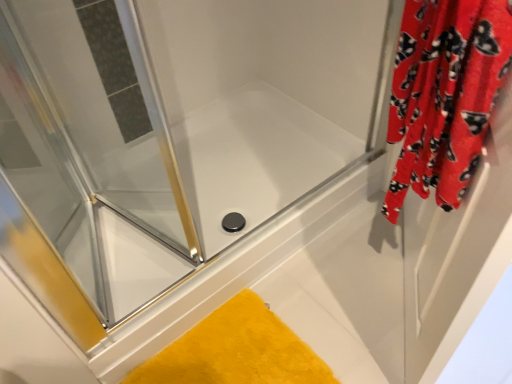
Describe the element at coordinates (91, 150) in the screenshot. The width and height of the screenshot is (512, 384). I see `clear glass shower door at upper left, the 1th screen door in the left-to-right sequence` at that location.

At what (x,y) coordinates should I click in order to perform the action: click on yellow plush bath mat at lower center. Please return your answer as a coordinate pair (x, y). Image resolution: width=512 pixels, height=384 pixels. Looking at the image, I should click on (236, 351).

Measure the distance between point (406, 42) and camera.

They are 30.79 inches apart.

This screenshot has width=512, height=384. What are the coordinates of `clear glass shower door at upper left, arranged as the second screen door when viewed from the right` in the screenshot? It's located at (91, 150).

Is clear glass shower door at upper left, the 1th screen door in the left-to-right sequence, not near red velvet curtain at right?

They are positioned close to each other.

Is clear glass shower door at upper left, the 1th screen door in the left-to-right sequence, in front of red velvet curtain at right?

No, clear glass shower door at upper left, the 1th screen door in the left-to-right sequence, is further to the viewer.

From the image's perspective, which is above, clear glass shower door at upper left, arranged as the second screen door when viewed from the right, or red velvet curtain at right?

clear glass shower door at upper left, arranged as the second screen door when viewed from the right, from the image's perspective.

Is clear glass shower door at upper left, arranged as the second screen door when viewed from the right, turned away from red velvet curtain at right?

clear glass shower door at upper left, arranged as the second screen door when viewed from the right, is not turned away from red velvet curtain at right.

Can you confirm if clear glass shower door at upper left, the 1th screen door in the left-to-right sequence, is smaller than red fabric curtain at right, the 2th screen door when ordered from left to right?

Indeed, clear glass shower door at upper left, the 1th screen door in the left-to-right sequence, has a smaller size compared to red fabric curtain at right, the 2th screen door when ordered from left to right.

From the image's perspective, relative to red fabric curtain at right, the 2th screen door when ordered from left to right, is clear glass shower door at upper left, the 1th screen door in the left-to-right sequence, above or below?

Clearly, from the image's perspective, clear glass shower door at upper left, the 1th screen door in the left-to-right sequence, is above red fabric curtain at right, the 2th screen door when ordered from left to right.

Does clear glass shower door at upper left, arranged as the second screen door when viewed from the right, have a lesser width compared to red fabric curtain at right, the 2th screen door when ordered from left to right?

No.

Does red fabric curtain at right, the 2th screen door when ordered from left to right, have a lesser width compared to clear glass shower door at upper left, the 1th screen door in the left-to-right sequence?

Yes, red fabric curtain at right, the 2th screen door when ordered from left to right, is thinner than clear glass shower door at upper left, the 1th screen door in the left-to-right sequence.

From the image's perspective, is red fabric curtain at right, acting as the first screen door starting from the right, under clear glass shower door at upper left, the 1th screen door in the left-to-right sequence?

Correct, red fabric curtain at right, acting as the first screen door starting from the right, appears lower than clear glass shower door at upper left, the 1th screen door in the left-to-right sequence, in the image.

Is red fabric curtain at right, acting as the first screen door starting from the right, oriented towards clear glass shower door at upper left, the 1th screen door in the left-to-right sequence?

No.

Which is in front, red fabric curtain at right, acting as the first screen door starting from the right, or clear glass shower door at upper left, arranged as the second screen door when viewed from the right?

red fabric curtain at right, acting as the first screen door starting from the right, is closer to the camera.

Considering the relative positions of yellow plush bath mat at lower center and clear glass shower door at upper left, arranged as the second screen door when viewed from the right, in the image provided, is yellow plush bath mat at lower center to the left or to the right of clear glass shower door at upper left, arranged as the second screen door when viewed from the right,?

yellow plush bath mat at lower center is to the right of clear glass shower door at upper left, arranged as the second screen door when viewed from the right.

Choose the correct answer: Is yellow plush bath mat at lower center inside clear glass shower door at upper left, arranged as the second screen door when viewed from the right, or outside it?

yellow plush bath mat at lower center exists outside the volume of clear glass shower door at upper left, arranged as the second screen door when viewed from the right.

Based on the photo, considering the relative sizes of yellow plush bath mat at lower center and clear glass shower door at upper left, the 1th screen door in the left-to-right sequence, in the image provided, is yellow plush bath mat at lower center bigger than clear glass shower door at upper left, the 1th screen door in the left-to-right sequence,?

No, yellow plush bath mat at lower center is not bigger than clear glass shower door at upper left, the 1th screen door in the left-to-right sequence.

Relative to clear glass shower door at upper left, the 1th screen door in the left-to-right sequence, is yellow plush bath mat at lower center in front or behind?

yellow plush bath mat at lower center is positioned farther from the viewer than clear glass shower door at upper left, the 1th screen door in the left-to-right sequence.

From the image's perspective, is yellow plush bath mat at lower center below red velvet curtain at right?

Yes, from the image's perspective, yellow plush bath mat at lower center is beneath red velvet curtain at right.

What's the angular difference between yellow plush bath mat at lower center and red velvet curtain at right's facing directions?

yellow plush bath mat at lower center and red velvet curtain at right are facing 132 degrees away from each other.

Which object is closer to the camera, yellow plush bath mat at lower center or red velvet curtain at right?

red velvet curtain at right is in front.

Which object is further away from the camera taking this photo, yellow plush bath mat at lower center or red fabric curtain at right, acting as the first screen door starting from the right?

yellow plush bath mat at lower center is further away from the camera.

Does point (246, 366) come closer to viewer compared to point (464, 285)?

No, (246, 366) is further to viewer.

From a real-world perspective, does yellow plush bath mat at lower center stand above red fabric curtain at right, the 2th screen door when ordered from left to right?

No, from a real-world perspective, yellow plush bath mat at lower center is not above red fabric curtain at right, the 2th screen door when ordered from left to right.

From a real-world perspective, is red fabric curtain at right, the 2th screen door when ordered from left to right, on top of yellow plush bath mat at lower center?

Yes, from a real-world perspective, red fabric curtain at right, the 2th screen door when ordered from left to right, is on top of yellow plush bath mat at lower center.

Considering the sizes of objects red fabric curtain at right, acting as the first screen door starting from the right, and yellow plush bath mat at lower center in the image provided, who is smaller, red fabric curtain at right, acting as the first screen door starting from the right, or yellow plush bath mat at lower center?

With smaller size is yellow plush bath mat at lower center.

Which is more to the right, red fabric curtain at right, acting as the first screen door starting from the right, or yellow plush bath mat at lower center?

red fabric curtain at right, acting as the first screen door starting from the right.

Would you say red fabric curtain at right, the 2th screen door when ordered from left to right, is inside or outside yellow plush bath mat at lower center?

red fabric curtain at right, the 2th screen door when ordered from left to right, is not inside yellow plush bath mat at lower center, it's outside.

The width and height of the screenshot is (512, 384). I want to click on curtain on the right of the clear glass shower door at upper left, arranged as the second screen door when viewed from the right, so click(x=444, y=95).

The width and height of the screenshot is (512, 384). I want to click on screen door located above the red fabric curtain at right, acting as the first screen door starting from the right (from the image's perspective), so click(x=91, y=150).

Which object lies further to the anchor point red fabric curtain at right, acting as the first screen door starting from the right, clear glass shower door at upper left, arranged as the second screen door when viewed from the right, or yellow plush bath mat at lower center?

Based on the image, clear glass shower door at upper left, arranged as the second screen door when viewed from the right, appears to be further to red fabric curtain at right, acting as the first screen door starting from the right.

In the scene shown: From the image, which object appears to be farther from red velvet curtain at right, yellow plush bath mat at lower center or clear glass shower door at upper left, the 1th screen door in the left-to-right sequence?

The object further to red velvet curtain at right is clear glass shower door at upper left, the 1th screen door in the left-to-right sequence.

From the image, which object appears to be nearer to clear glass shower door at upper left, the 1th screen door in the left-to-right sequence, red velvet curtain at right or red fabric curtain at right, the 2th screen door when ordered from left to right?

red velvet curtain at right is closer to clear glass shower door at upper left, the 1th screen door in the left-to-right sequence.

When comparing their distances from red fabric curtain at right, acting as the first screen door starting from the right, does red velvet curtain at right or clear glass shower door at upper left, arranged as the second screen door when viewed from the right, seem further?

clear glass shower door at upper left, arranged as the second screen door when viewed from the right, lies further to red fabric curtain at right, acting as the first screen door starting from the right, than the other object.

When comparing their distances from yellow plush bath mat at lower center, does clear glass shower door at upper left, the 1th screen door in the left-to-right sequence, or red fabric curtain at right, the 2th screen door when ordered from left to right, seem closer?

Among the two, red fabric curtain at right, the 2th screen door when ordered from left to right, is located nearer to yellow plush bath mat at lower center.

From the image, which object appears to be nearer to yellow plush bath mat at lower center, red velvet curtain at right or red fabric curtain at right, the 2th screen door when ordered from left to right?

red fabric curtain at right, the 2th screen door when ordered from left to right.

Looking at this image, considering their positions, is red velvet curtain at right positioned further to red fabric curtain at right, the 2th screen door when ordered from left to right, than yellow plush bath mat at lower center?

yellow plush bath mat at lower center is positioned further to the anchor red fabric curtain at right, the 2th screen door when ordered from left to right.

When comparing their distances from red velvet curtain at right, does clear glass shower door at upper left, arranged as the second screen door when viewed from the right, or red fabric curtain at right, the 2th screen door when ordered from left to right, seem closer?

The object closer to red velvet curtain at right is red fabric curtain at right, the 2th screen door when ordered from left to right.

This screenshot has height=384, width=512. Find the location of `curtain situated between clear glass shower door at upper left, arranged as the second screen door when viewed from the right, and red fabric curtain at right, acting as the first screen door starting from the right, from left to right`. curtain situated between clear glass shower door at upper left, arranged as the second screen door when viewed from the right, and red fabric curtain at right, acting as the first screen door starting from the right, from left to right is located at coordinates (444, 95).

Where is `screen door between red velvet curtain at right and yellow plush bath mat at lower center in the up-down direction`? screen door between red velvet curtain at right and yellow plush bath mat at lower center in the up-down direction is located at coordinates (457, 253).

Where is `curtain between clear glass shower door at upper left, arranged as the second screen door when viewed from the right, and yellow plush bath mat at lower center from top to bottom`? The width and height of the screenshot is (512, 384). curtain between clear glass shower door at upper left, arranged as the second screen door when viewed from the right, and yellow plush bath mat at lower center from top to bottom is located at coordinates (444, 95).

Locate an element on the screen. bath mat situated between clear glass shower door at upper left, the 1th screen door in the left-to-right sequence, and red fabric curtain at right, the 2th screen door when ordered from left to right, from left to right is located at coordinates coord(236,351).